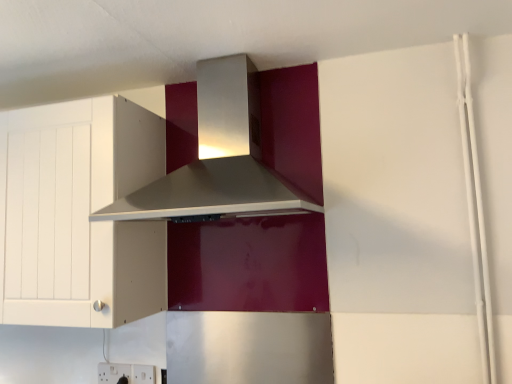
Question: Would you consider white matte cabinet at left to be distant from white plastic electric outlet at lower left, marked as the 1th electric outlet in a left-to-right arrangement?

Choices:
 (A) no
 (B) yes

Answer: (A)

Question: Is the position of white matte cabinet at left more distant than that of white plastic electric outlet at lower left, marked as the 1th electric outlet in a left-to-right arrangement?

Choices:
 (A) yes
 (B) no

Answer: (B)

Question: Considering the relative positions of white matte cabinet at left and white plastic electric outlet at lower left, the second electric outlet viewed from the right, in the image provided, is white matte cabinet at left in front of white plastic electric outlet at lower left, the second electric outlet viewed from the right,?

Choices:
 (A) no
 (B) yes

Answer: (B)

Question: Could you tell me if white matte cabinet at left is facing white plastic electric outlet at lower left, marked as the 1th electric outlet in a left-to-right arrangement?

Choices:
 (A) yes
 (B) no

Answer: (B)

Question: Is white matte cabinet at left positioned beyond the bounds of white plastic electric outlet at lower left, marked as the 1th electric outlet in a left-to-right arrangement?

Choices:
 (A) yes
 (B) no

Answer: (A)

Question: Considering the relative sizes of white matte cabinet at left and white plastic electric outlet at lower left, marked as the 1th electric outlet in a left-to-right arrangement, in the image provided, is white matte cabinet at left taller than white plastic electric outlet at lower left, marked as the 1th electric outlet in a left-to-right arrangement,?

Choices:
 (A) yes
 (B) no

Answer: (A)

Question: Considering the relative sizes of satin silver range hood at upper center and white plastic electric outlet at lower left, the second electric outlet viewed from the right, in the image provided, is satin silver range hood at upper center wider than white plastic electric outlet at lower left, the second electric outlet viewed from the right,?

Choices:
 (A) yes
 (B) no

Answer: (A)

Question: Does satin silver range hood at upper center have a greater height compared to white plastic electric outlet at lower left, the second electric outlet viewed from the right?

Choices:
 (A) yes
 (B) no

Answer: (A)

Question: From the image's perspective, is satin silver range hood at upper center over white plastic electric outlet at lower left, the second electric outlet viewed from the right?

Choices:
 (A) no
 (B) yes

Answer: (B)

Question: From a real-world perspective, is satin silver range hood at upper center positioned over white plastic electric outlet at lower left, marked as the 1th electric outlet in a left-to-right arrangement, based on gravity?

Choices:
 (A) yes
 (B) no

Answer: (A)

Question: From a real-world perspective, is satin silver range hood at upper center below white plastic electric outlet at lower left, the second electric outlet viewed from the right?

Choices:
 (A) no
 (B) yes

Answer: (A)

Question: Is satin silver range hood at upper center facing away from white plastic electric outlet at lower left, marked as the 1th electric outlet in a left-to-right arrangement?

Choices:
 (A) yes
 (B) no

Answer: (B)

Question: Is white plastic electric outlet at lower left, marked as the 1th electric outlet in a left-to-right arrangement, outside satin silver range hood at upper center?

Choices:
 (A) yes
 (B) no

Answer: (A)